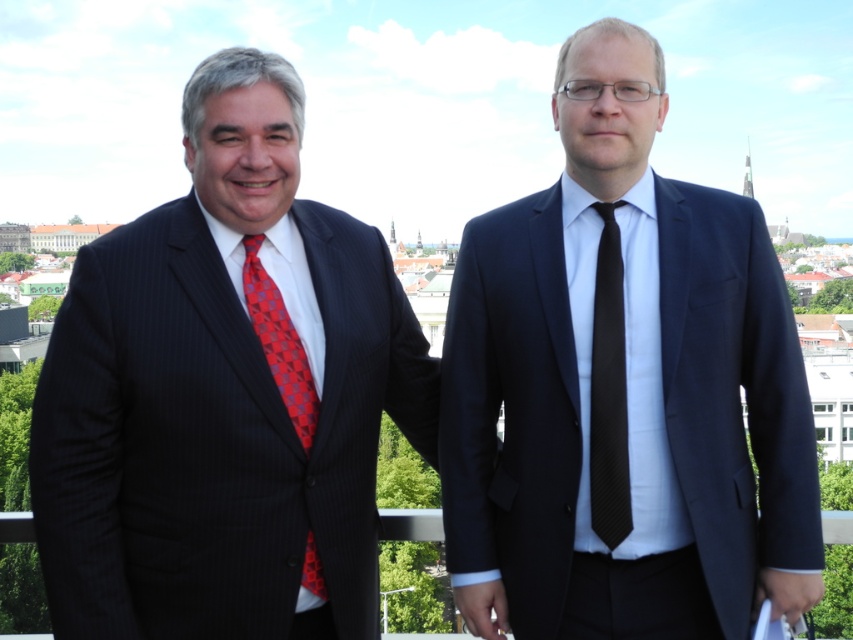
Which is in front, point (550, 548) or point (618, 387)?

Positioned in front is point (550, 548).

Where is `matte black suit at right`? The width and height of the screenshot is (853, 640). matte black suit at right is located at coordinates (622, 388).

Find the location of `matte black suit at right`. matte black suit at right is located at coordinates (622, 388).

Does point (619, 410) come behind point (271, 364)?

Yes.

Who is higher up, black textured tie at center or red checkered tie at left?

black textured tie at center is higher up.

Who is more distant from viewer, (608, 406) or (296, 384)?

Positioned behind is point (608, 406).

Identify the location of black textured tie at center. (x=608, y=390).

Which is more to the right, matte black suit at left or black textured tie at center?

From the viewer's perspective, black textured tie at center appears more on the right side.

Consider the image. Is matte black suit at left shorter than black textured tie at center?

No.

Which is behind, point (283, 307) or point (619, 252)?

Positioned behind is point (619, 252).

The width and height of the screenshot is (853, 640). Find the location of `matte black suit at left`. matte black suit at left is located at coordinates (225, 394).